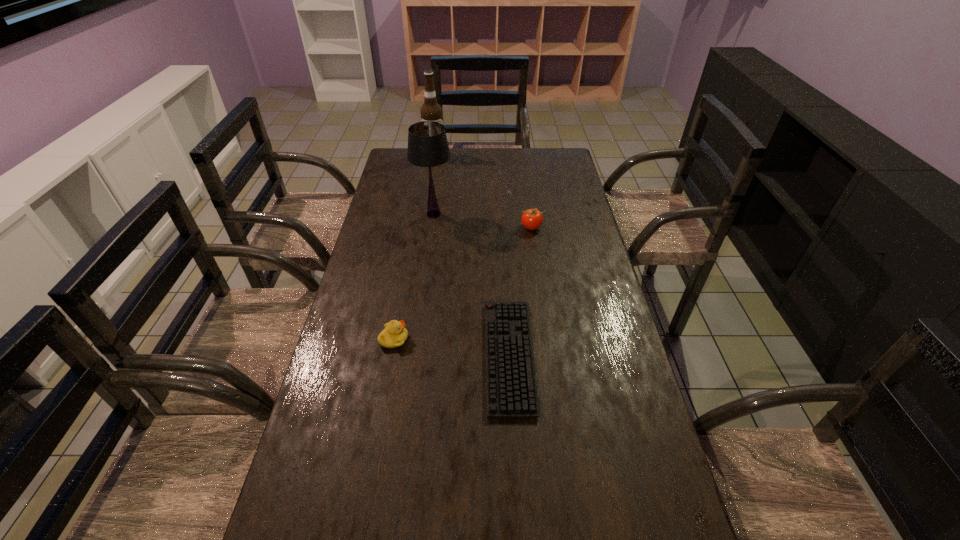
This screenshot has height=540, width=960. Identify the location of vacant area situated 0.090m on the right of the second object from right to left. (566, 356).

You are a GUI agent. You are given a task and a screenshot of the screen. Output one action in this format:
    pyautogui.click(x=<x>, y=<y>)
    Task: Click on the object that is positioned at the far edge
    This screenshot has width=960, height=540.
    Given the screenshot: What is the action you would take?
    pos(430,111)

Where is `alcohol that is at the left edge`? Image resolution: width=960 pixels, height=540 pixels. alcohol that is at the left edge is located at coordinates (430, 111).

What are the coordinates of `lampshade that is at the left edge` in the screenshot? It's located at click(427, 142).

This screenshot has width=960, height=540. What are the coordinates of `duckling that is at the left edge` in the screenshot? It's located at (394, 335).

At what (x,y) coordinates should I click in order to perform the action: click on object situated at the far left corner. Please return your answer as a coordinate pair (x, y). Looking at the image, I should click on (430, 111).

At what (x,y) coordinates should I click in order to perform the action: click on vacant space at the far edge of the desktop. Please return your answer as a coordinate pair (x, y). Looking at the image, I should click on (452, 158).

You are a GUI agent. You are given a task and a screenshot of the screen. Output one action in this format:
    pyautogui.click(x=<x>, y=<y>)
    Task: Click on the vacant space at the left edge of the desktop
    The height and width of the screenshot is (540, 960).
    Given the screenshot: What is the action you would take?
    pyautogui.click(x=395, y=183)

This screenshot has width=960, height=540. In the image, there is a desktop. Identify the location of vacant space at the right edge. (649, 421).

You are a GUI agent. You are given a task and a screenshot of the screen. Output one action in this format:
    pyautogui.click(x=<x>, y=<y>)
    Task: Click on the vacant space that is in between the computer keyboard and the farthest object
    
    Given the screenshot: What is the action you would take?
    pyautogui.click(x=471, y=256)